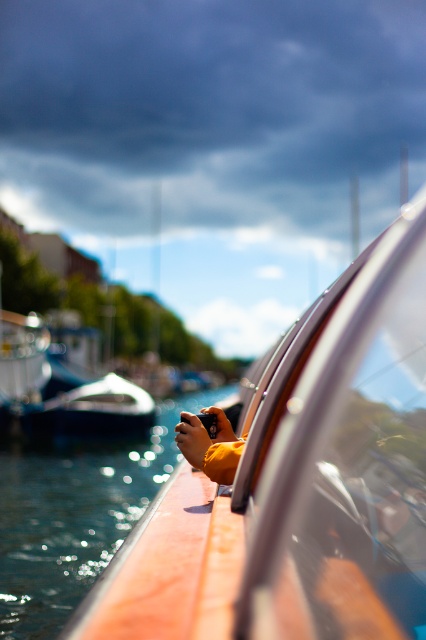
Based on the photo, you are a delivery drone operator. Your drone needs to fly from the transparent glass car window at center to the camera held by the person on the boat. The drone has a maximum flight range of 2 meters. Can the drone make the trip without needing to recharge?

The distance between the transparent glass car window at center and the camera is 1.93 meters. Since the drone can fly up to 2 meters, it can make the trip without needing to recharge.

In the scene shown: You are on a boat in the canal. You notice two points marked in the scene. The first point is at coordinates point (371, 381) and the second is at point (51, 547). If you are facing forward, which point would you see closer to your current position?

Point (371, 381) is in front of point (51, 547), so you would see point (371, 381) closer to your current position when facing forward.